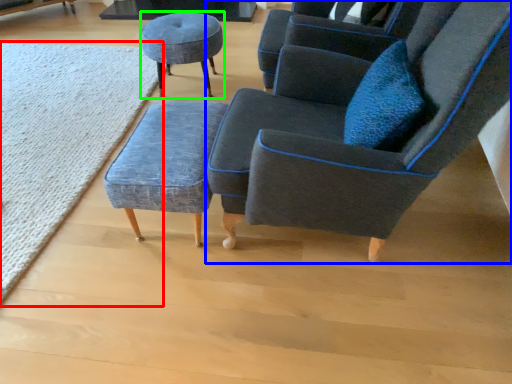
Question: Based on their relative distances, which object is nearer to mat (highlighted by a red box)? Choose from chair (highlighted by a blue box) and stool (highlighted by a green box).

Choices:
 (A) chair
 (B) stool

Answer: (B)